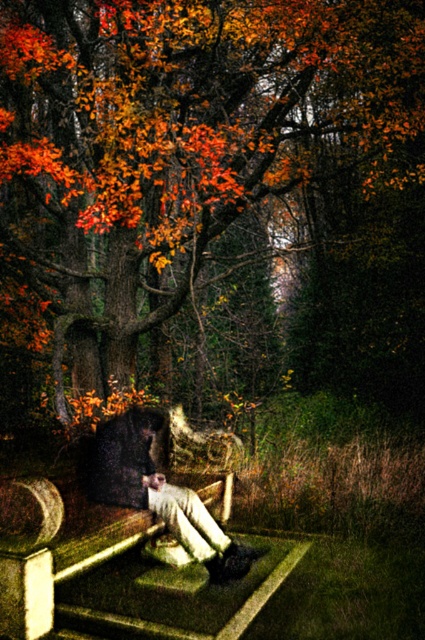
Is point (212, 148) positioned after point (133, 493)?

Yes.

Can you confirm if autumn leaves at center is positioned above matte black coat at center?

Answer: Yes, autumn leaves at center is above matte black coat at center.

Locate an element on the screen. autumn leaves at center is located at coordinates (178, 145).

Identify the location of autumn leaves at center. (178, 145).